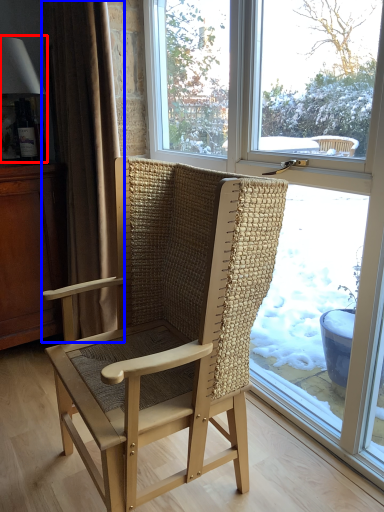
Question: Which object is further to the camera taking this photo, lamp (highlighted by a red box) or curtain (highlighted by a blue box)?

Choices:
 (A) lamp
 (B) curtain

Answer: (A)